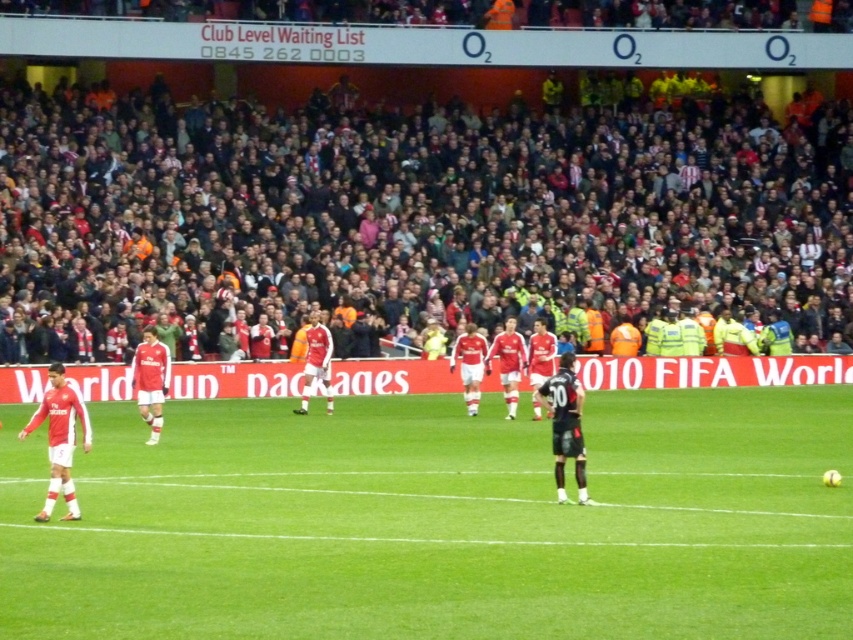
Can you confirm if dark red jersey at upper center is thinner than matte red jersey at left?

Incorrect, dark red jersey at upper center's width is not less than matte red jersey at left's.

Is point (525, 115) behind point (218, 371)?

Yes, point (525, 115) is farther from viewer.

Where is `dark red jersey at upper center`? The width and height of the screenshot is (853, 640). dark red jersey at upper center is located at coordinates (409, 218).

Between point (178, 573) and point (55, 170), which one is positioned behind?

Point (55, 170)

Which is above, green grass field at center or dark red jersey at upper center?

dark red jersey at upper center is higher up.

Does point (424, 600) come farther from viewer compared to point (78, 241)?

No, (424, 600) is closer to viewer.

At what (x,y) coordinates should I click in order to perform the action: click on green grass field at center. Please return your answer as a coordinate pair (x, y). This screenshot has height=640, width=853. Looking at the image, I should click on (440, 522).

Is green grass field at center positioned at the back of matte red jersey at left?

That is False.

Which is behind, point (288, 433) or point (538, 406)?

Positioned behind is point (538, 406).

At what (x,y) coordinates should I click in order to perform the action: click on green grass field at center. Please return your answer as a coordinate pair (x, y). Looking at the image, I should click on (440, 522).